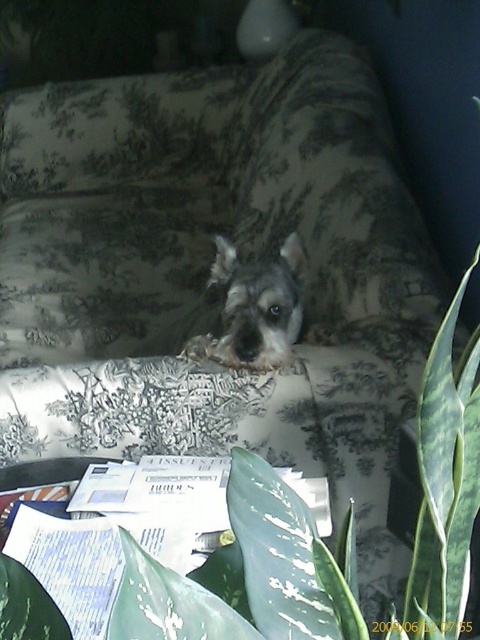
Question: Does green leafy plant at center appear on the left side of gray fur dog at center?

Choices:
 (A) yes
 (B) no

Answer: (B)

Question: From the image, what is the correct spatial relationship of green leafy plant at center in relation to gray fur dog at center?

Choices:
 (A) right
 (B) left

Answer: (A)

Question: Is green leafy plant at center above gray fur dog at center?

Choices:
 (A) yes
 (B) no

Answer: (B)

Question: Which point is closer to the camera?

Choices:
 (A) (295, 291)
 (B) (121, 604)

Answer: (B)

Question: Which point is farther to the camera?

Choices:
 (A) (294, 276)
 (B) (252, 611)

Answer: (A)